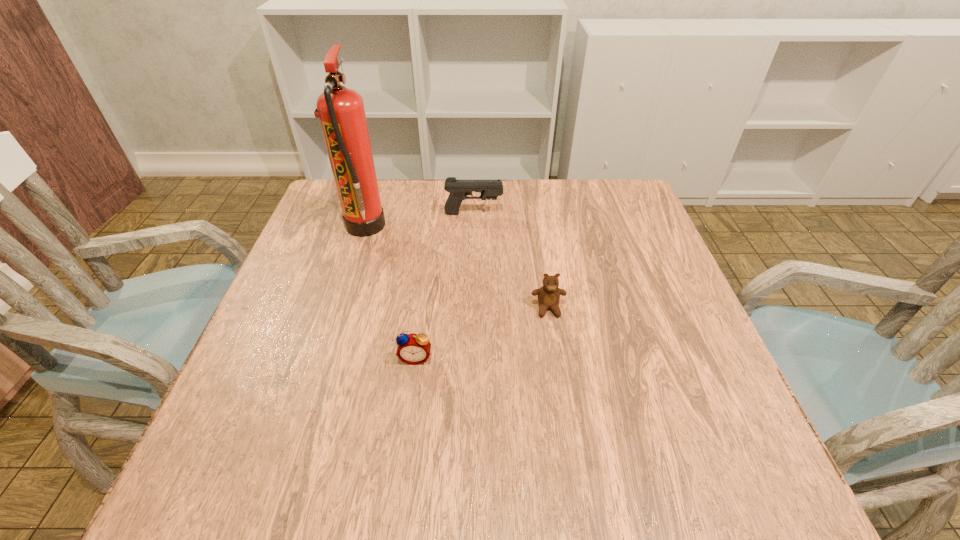
Identify the location of object identified as the second closest to the second tallest object. The image size is (960, 540). (549, 294).

The width and height of the screenshot is (960, 540). What are the coordinates of `free point that satisfies the following two spatial constraints: 1. at the barrel of the pistol; 2. on the front-facing side of the alarm clock` in the screenshot? It's located at (470, 357).

The height and width of the screenshot is (540, 960). In order to click on free region that satisfies the following two spatial constraints: 1. at the barrel of the pistol; 2. on the front-facing side of the alarm clock in this screenshot , I will do `click(470, 357)`.